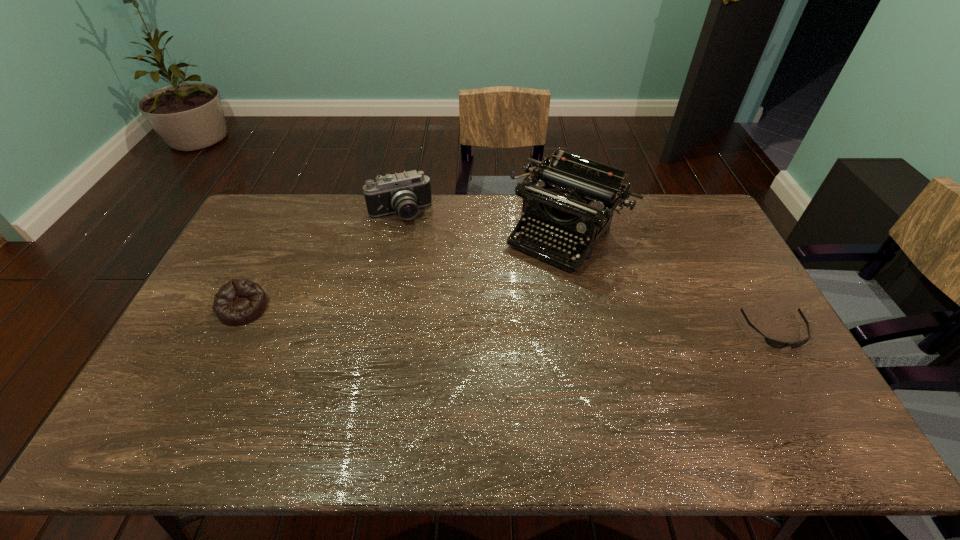
Locate an element on the screen. The height and width of the screenshot is (540, 960). free space on the desktop that is between the third tallest object and the shortest object and is positioned on the keyboard of the tallest object is located at coordinates (499, 319).

I want to click on vacant spot on the desktop that is between the third tallest object and the shortest object and is positioned on the front-facing side of the second object from left to right, so click(442, 317).